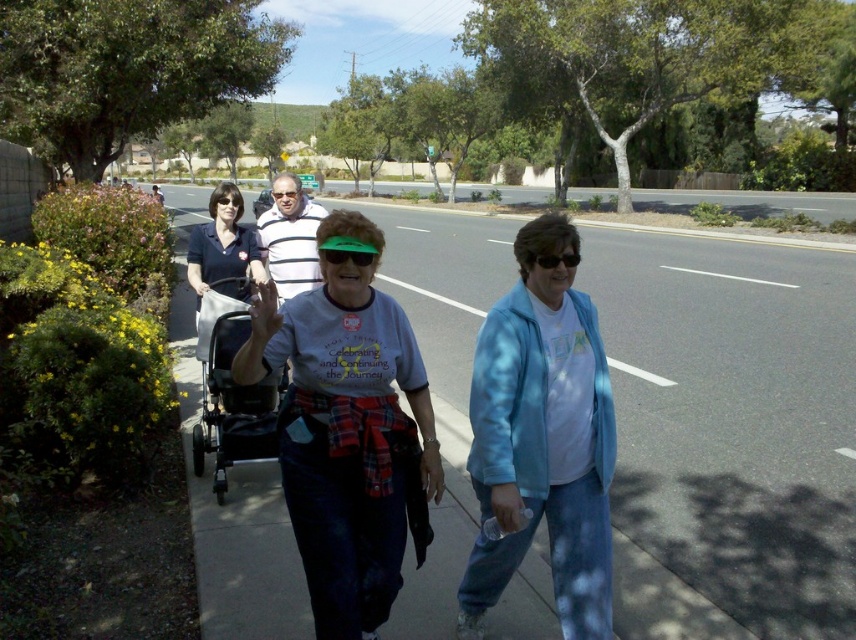
Question: Considering the real-world distances, which object is closest to the matte blue shirt at upper left?

Choices:
 (A) green matte sunglasses at center
 (B) asphalt at center

Answer: (A)

Question: Which of the following is the closest to the observer?

Choices:
 (A) light blue t-shirt at center
 (B) green matte sunglasses at center
 (C) matte blue shirt at upper left
 (D) black plastic baby carriage at center

Answer: (A)

Question: Is blue fabric jacket at center below green matte sunglasses at center?

Choices:
 (A) yes
 (B) no

Answer: (A)

Question: Is asphalt at center positioned in front of black plastic baby carriage at center?

Choices:
 (A) no
 (B) yes

Answer: (B)

Question: Is light blue t-shirt at center to the right of green matte sunglasses at center from the viewer's perspective?

Choices:
 (A) no
 (B) yes

Answer: (A)

Question: Which object is positioned farthest from the black plastic sunglasses at center?

Choices:
 (A) green matte sunglasses at center
 (B) blue fabric jacket at center

Answer: (A)